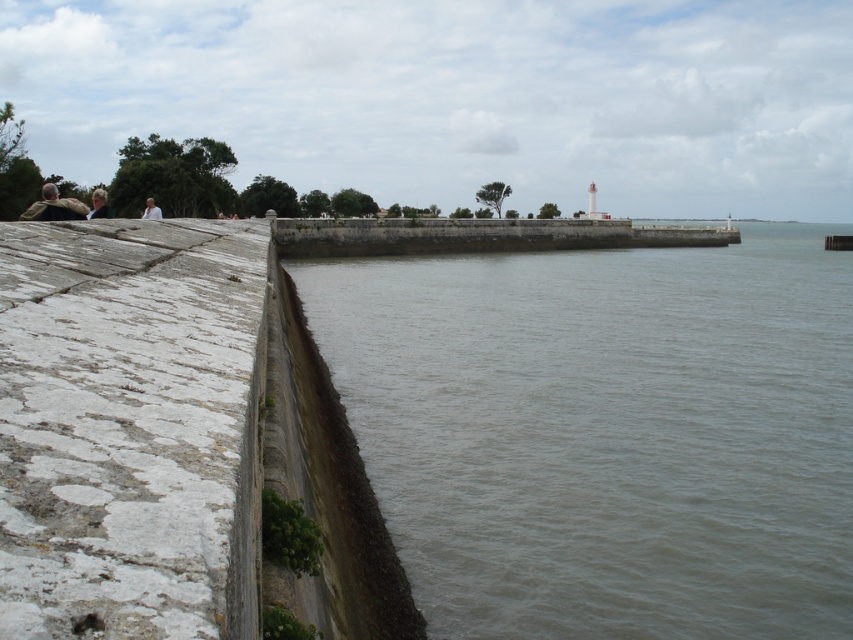
Question: Which object appears closest to the camera in this image?

Choices:
 (A) gray concrete water at center
 (B) light brown hair at upper left
 (C) camouflage jacket at left
 (D) white fabric at upper left

Answer: (A)

Question: Is camouflage jacket at left to the right of light brown hair at upper left from the viewer's perspective?

Choices:
 (A) yes
 (B) no

Answer: (B)

Question: Is gray concrete water at center above white fabric at upper left?

Choices:
 (A) yes
 (B) no

Answer: (B)

Question: Which point is farther from the camera taking this photo?

Choices:
 (A) (108, 212)
 (B) (53, 216)

Answer: (A)

Question: Which point is closer to the camera?

Choices:
 (A) camouflage jacket at left
 (B) light brown hair at upper left
 (C) white fabric at upper left
 (D) gray concrete water at center

Answer: (D)

Question: Considering the relative positions of gray concrete water at center and white fabric at upper left in the image provided, where is gray concrete water at center located with respect to white fabric at upper left?

Choices:
 (A) above
 (B) below

Answer: (B)